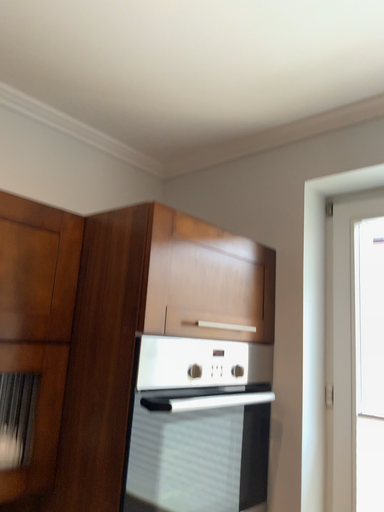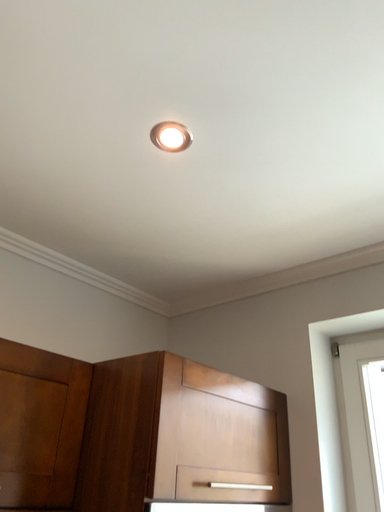
Question: How did the camera likely rotate when shooting the video?

Choices:
 (A) rotated downward
 (B) rotated upward

Answer: (B)